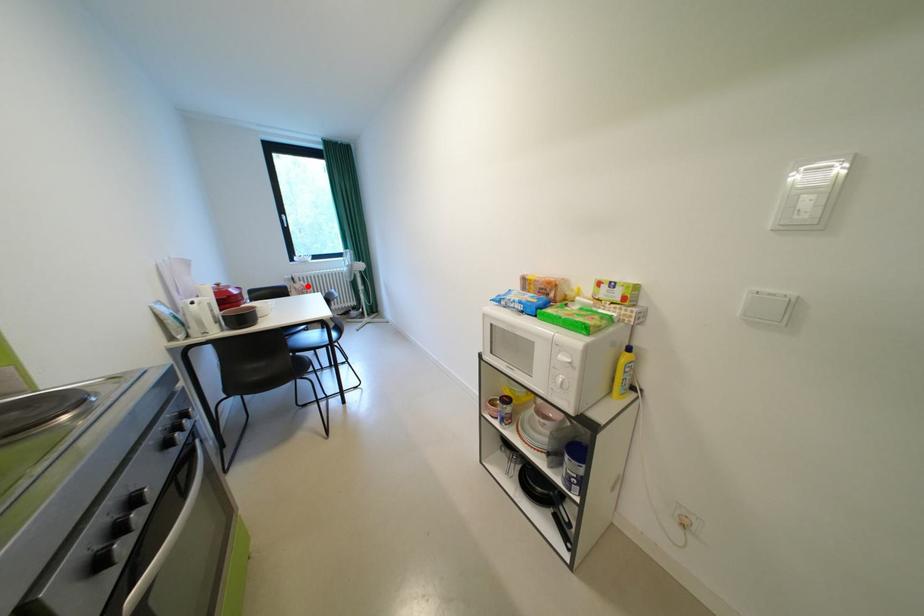
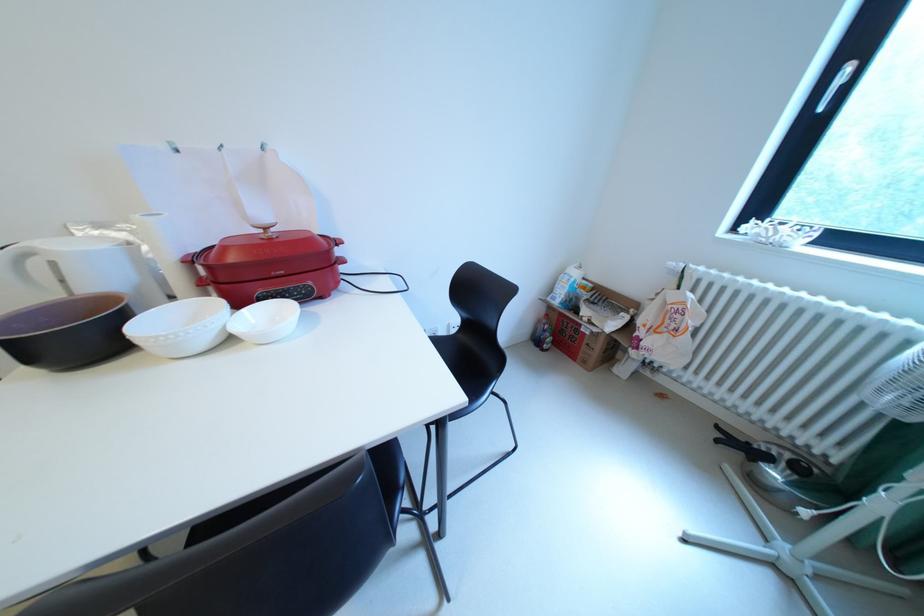
Question: I am providing you with two images of the same scene from different viewpoints. In image1, a red point is highlighted. Considering the same 3D point in image2, which of the following is correct?

Choices:
 (A) It is closer
 (B) It is farther

Answer: (A)